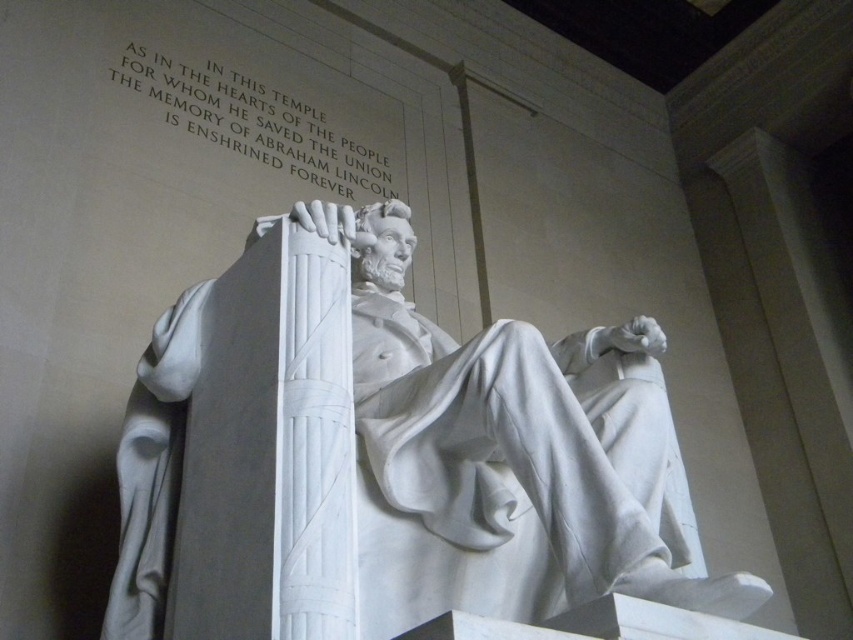
Does white marble statue at center have a lesser height compared to white marble text at upper center?

In fact, white marble statue at center may be taller than white marble text at upper center.

Who is higher up, white marble statue at center or white marble text at upper center?

white marble text at upper center is above.

Between point (425, 376) and point (181, 64), which one is positioned behind?

Point (181, 64)

Where is `white marble statue at center`? This screenshot has height=640, width=853. white marble statue at center is located at coordinates (509, 458).